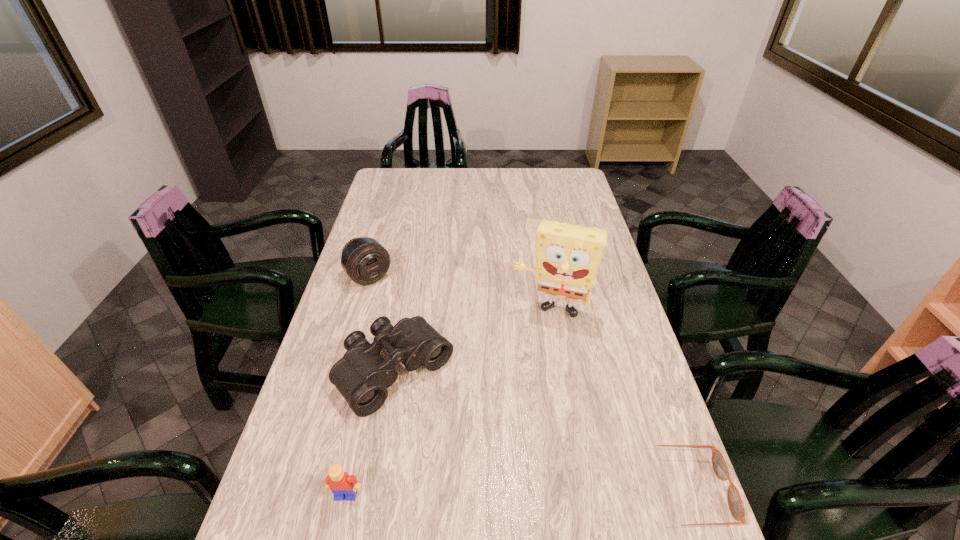
I want to click on binoculars situated at the left edge, so click(362, 376).

Image resolution: width=960 pixels, height=540 pixels. What are the coordinates of `telephoto lens at the left edge` in the screenshot? It's located at (365, 260).

Where is `sunglasses at the right edge`? This screenshot has width=960, height=540. sunglasses at the right edge is located at coordinates (736, 507).

Where is `sponge located at the right edge`? This screenshot has height=540, width=960. sponge located at the right edge is located at coordinates (568, 256).

What are the coordinates of `object that is at the near right corner` in the screenshot? It's located at (736, 507).

Find the location of a particular element. Image resolution: width=960 pixels, height=540 pixels. free point at the far edge is located at coordinates (515, 177).

The image size is (960, 540). I want to click on free location at the near edge of the desktop, so click(516, 514).

This screenshot has height=540, width=960. Identify the location of vacant area at the left edge of the desktop. (303, 423).

You are a GUI agent. You are given a task and a screenshot of the screen. Output one action in this format:
    pyautogui.click(x=<x>, y=<y>)
    Task: Click on the vacant region at the right edge
    This screenshot has width=960, height=540.
    Given the screenshot: What is the action you would take?
    pyautogui.click(x=645, y=485)

The height and width of the screenshot is (540, 960). Identify the location of vacant space at the far left corner of the desktop. (390, 175).